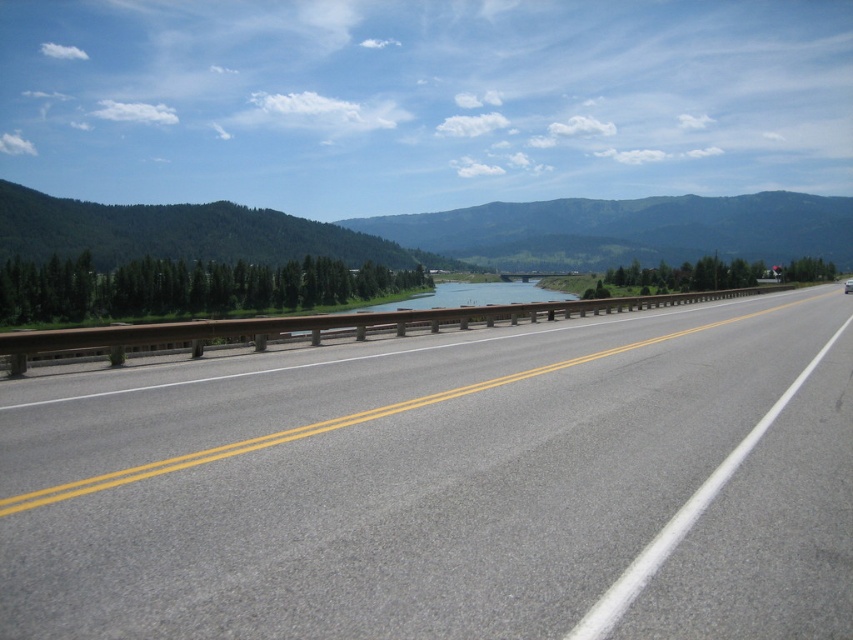
Question: Is gray asphalt highway at center positioned behind metallic gray bridge at center?

Choices:
 (A) yes
 (B) no

Answer: (B)

Question: Does gray asphalt highway at center appear on the left side of green textured mountain at center?

Choices:
 (A) yes
 (B) no

Answer: (A)

Question: Considering the real-world distances, which object is closest to the metallic gray bridge at center?

Choices:
 (A) gray asphalt highway at center
 (B) green textured mountain at center

Answer: (A)

Question: Which of these objects is positioned farthest from the green textured mountain at center?

Choices:
 (A) metallic gray bridge at center
 (B) gray asphalt highway at center

Answer: (B)

Question: Based on their relative distances, which object is farther from the green textured mountain at center?

Choices:
 (A) gray asphalt highway at center
 (B) metallic gray bridge at center

Answer: (A)

Question: Does gray asphalt highway at center appear over green textured mountain at center?

Choices:
 (A) no
 (B) yes

Answer: (A)